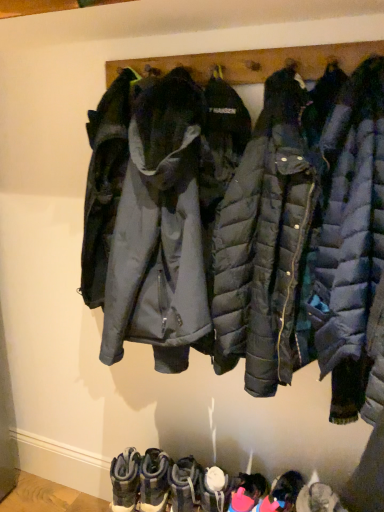
Question: Would you say matte black puffer jacket at center is part of white matte boot at lower center, which is counted as the third footwear, starting from the right,'s contents?

Choices:
 (A) yes
 (B) no

Answer: (B)

Question: Is white matte boot at lower center, which is counted as the third footwear, starting from the right, at the right side of matte black puffer jacket at center?

Choices:
 (A) no
 (B) yes

Answer: (A)

Question: Would you say white matte boot at lower center, which is counted as the third footwear, starting from the right, is outside matte black puffer jacket at center?

Choices:
 (A) no
 (B) yes

Answer: (B)

Question: From a real-world perspective, is white matte boot at lower center, the 4th footwear from the left, beneath matte black puffer jacket at center?

Choices:
 (A) yes
 (B) no

Answer: (A)

Question: Does white matte boot at lower center, which is counted as the third footwear, starting from the right, have a lesser height compared to matte black puffer jacket at center?

Choices:
 (A) yes
 (B) no

Answer: (A)

Question: Does point (264, 386) appear closer or farther from the camera than point (210, 466)?

Choices:
 (A) farther
 (B) closer

Answer: (B)

Question: Is matte black puffer jacket at center inside or outside of white matte boot at lower center, which is counted as the third footwear, starting from the right?

Choices:
 (A) inside
 (B) outside

Answer: (B)

Question: From a real-world perspective, is matte black puffer jacket at center physically located above or below white matte boot at lower center, the 4th footwear from the left?

Choices:
 (A) below
 (B) above

Answer: (B)

Question: In the image, is matte black puffer jacket at center positioned in front of or behind white matte boot at lower center, which is counted as the third footwear, starting from the right?

Choices:
 (A) front
 (B) behind

Answer: (A)

Question: From a real-world perspective, relative to pink fabric boot at lower center, positioned as the 5th footwear in left-to-right order, is leather suede boots at lower center, which ranks as the fifth footwear in right-to-left order, vertically above or below?

Choices:
 (A) below
 (B) above

Answer: (B)

Question: In the image, is leather suede boots at lower center, which is the 2th footwear in left-to-right order, on the left side or the right side of pink fabric boot at lower center, positioned as the 5th footwear in left-to-right order?

Choices:
 (A) left
 (B) right

Answer: (A)

Question: Is point (144, 499) closer or farther from the camera than point (231, 494)?

Choices:
 (A) closer
 (B) farther

Answer: (B)

Question: Looking at the image, does leather suede boots at lower center, which ranks as the fifth footwear in right-to-left order, seem bigger or smaller compared to pink fabric boot at lower center, which ranks as the second footwear in right-to-left order?

Choices:
 (A) big
 (B) small

Answer: (A)

Question: Is point click(x=92, y=183) positioned closer to the camera than point click(x=150, y=505)?

Choices:
 (A) closer
 (B) farther

Answer: (A)

Question: Considering their positions, is matte black puffer jacket at center located in front of or behind leather suede boots at lower center, which is the 2th footwear in left-to-right order?

Choices:
 (A) front
 (B) behind

Answer: (A)